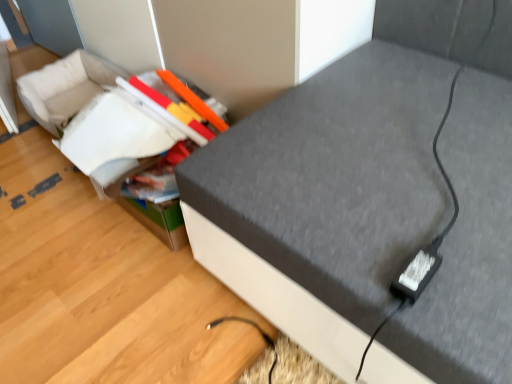
Question: In the image, is textured gray sofa at center positioned in front of or behind matte plastic storage box at center?

Choices:
 (A) behind
 (B) front

Answer: (B)

Question: From the image's perspective, relative to matte plastic storage box at center, is textured gray sofa at center above or below?

Choices:
 (A) below
 (B) above

Answer: (B)

Question: Based on their relative distances, which object is farther from the textured gray sofa at center?

Choices:
 (A) black plastic plug at lower right
 (B) matte plastic storage box at center

Answer: (B)

Question: Which object is positioned closest to the black plastic plug at lower right?

Choices:
 (A) matte plastic storage box at center
 (B) textured gray sofa at center

Answer: (B)